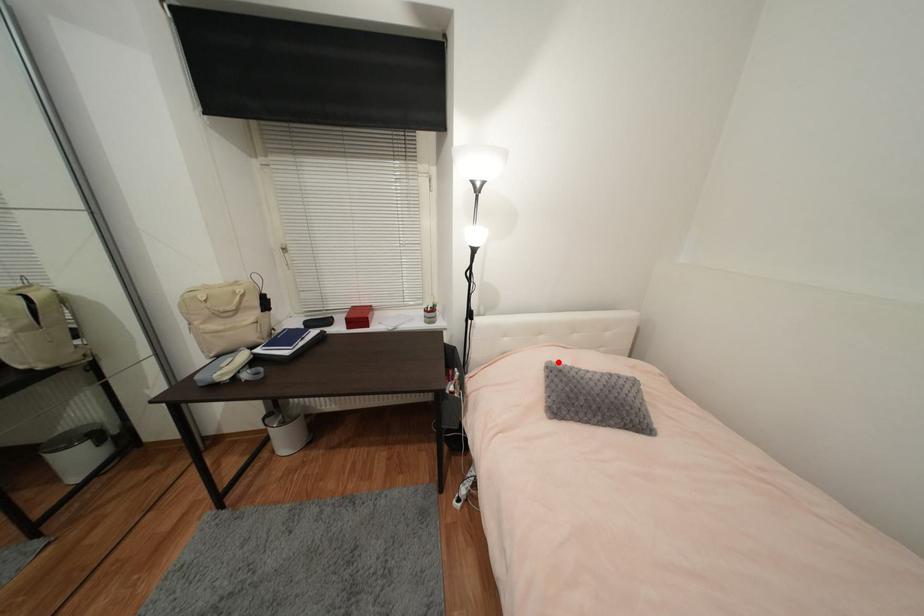
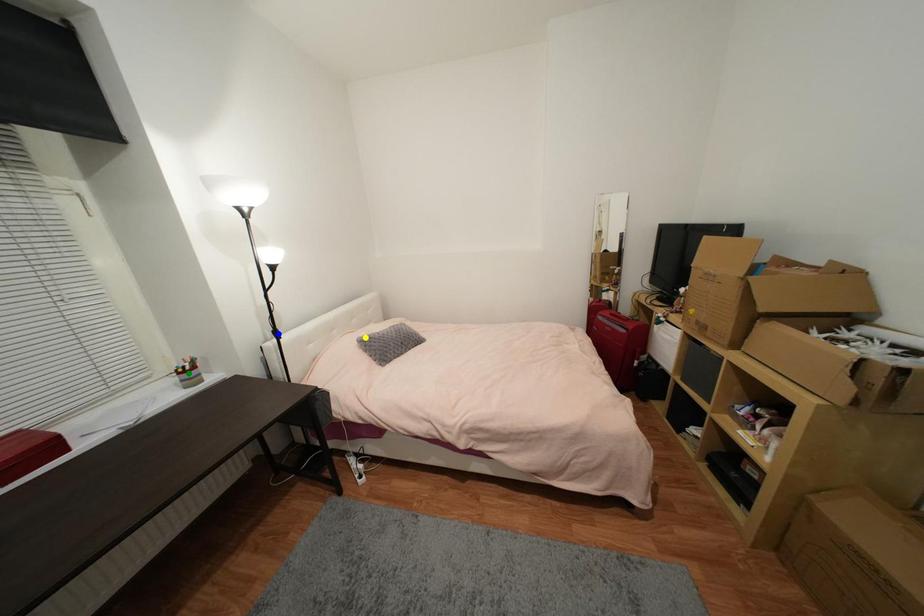
Question: I am providing you with two images of the same scene from different viewpoints. A red point is marked on the first image. You are given multiple points on the second image. In image 2, which mark is for the same physical point as the one in image 1?

Choices:
 (A) yellow point
 (B) green point
 (C) blue point

Answer: (A)